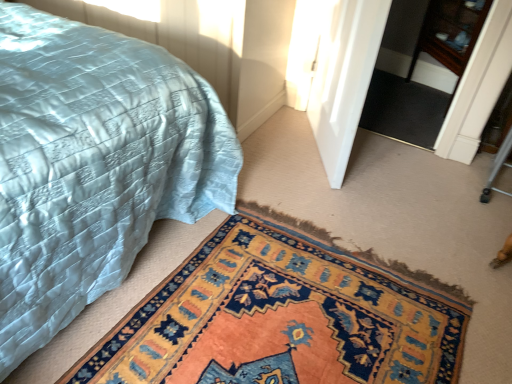
You are a GUI agent. You are given a task and a screenshot of the screen. Output one action in this format:
    pyautogui.click(x=<x>, y=<y>)
    Task: Click on the vacant space in wooden dresser at upper right (from a real-world perspective)
    
    Given the screenshot: What is the action you would take?
    pyautogui.click(x=404, y=97)